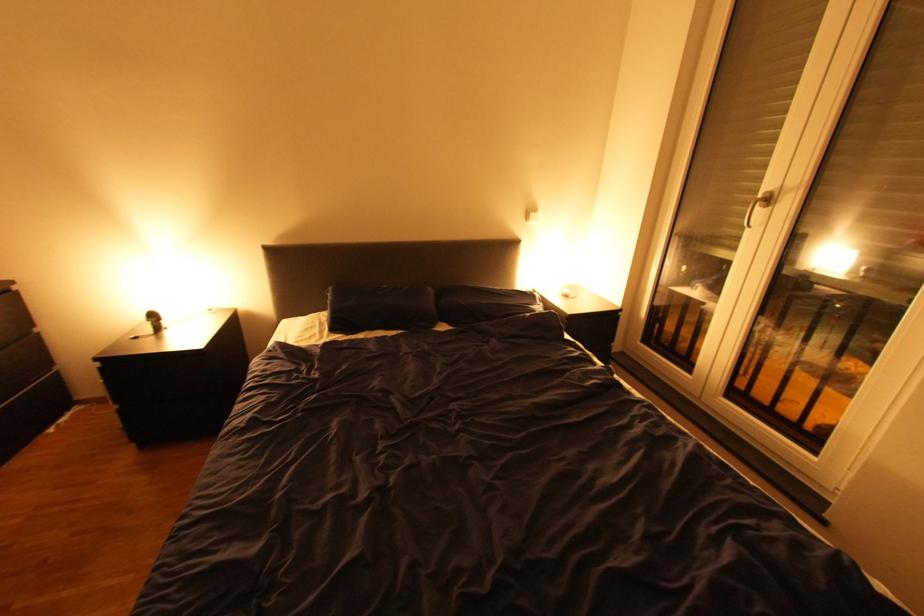
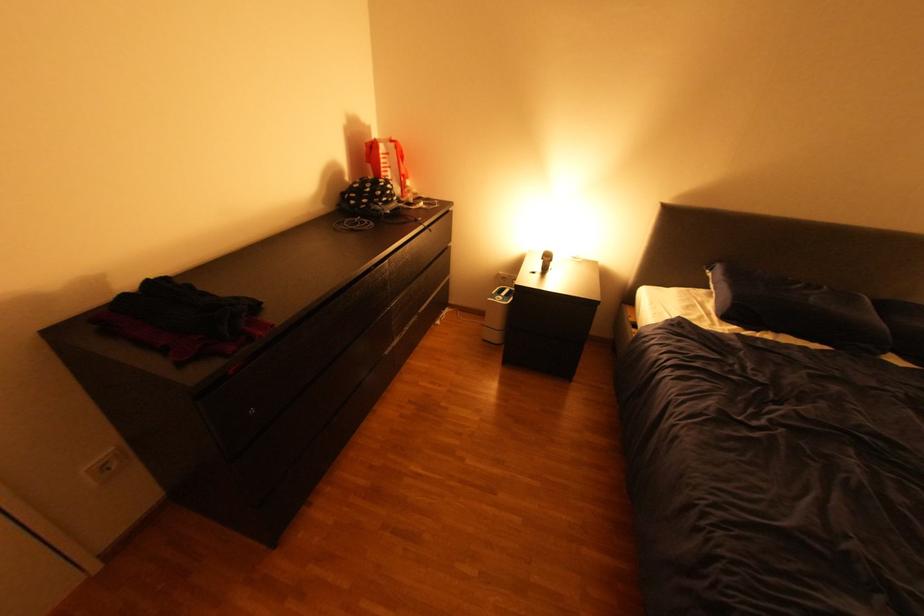
In the second image, find the point that corresponds to (x=172, y=322) in the first image.

(561, 262)